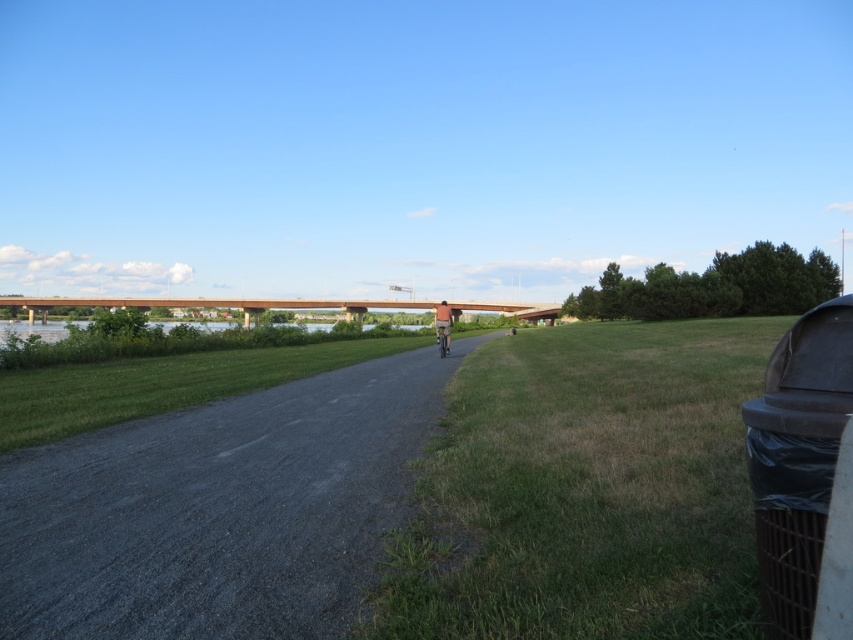
Consider the image. Is green grass at center above gray gravel path at center?

Indeed, green grass at center is positioned over gray gravel path at center.

This screenshot has height=640, width=853. I want to click on green grass at center, so click(585, 490).

Is point (639, 563) positioned behind point (390, 413)?

No, (639, 563) is closer to viewer.

This screenshot has height=640, width=853. I want to click on green grass at center, so click(585, 490).

Who is positioned more to the left, green grass at center or metallic silver bicycle at center?

metallic silver bicycle at center

Who is more forward, [560,464] or [444,336]?

Point [560,464] is more forward.

Find the location of `green grass at center`. green grass at center is located at coordinates (585, 490).

Between point (142, 451) and point (438, 332), which one is positioned behind?

Point (438, 332)

Does point (254, 618) lie in front of point (447, 333)?

That is True.

Is point (161, 420) closer to camera compared to point (436, 328)?

Yes.

You are a GUI agent. You are given a task and a screenshot of the screen. Output one action in this format:
    pyautogui.click(x=<x>, y=<y>)
    Task: Click on the gray gravel path at center
    The height and width of the screenshot is (640, 853).
    Given the screenshot: What is the action you would take?
    pyautogui.click(x=219, y=509)